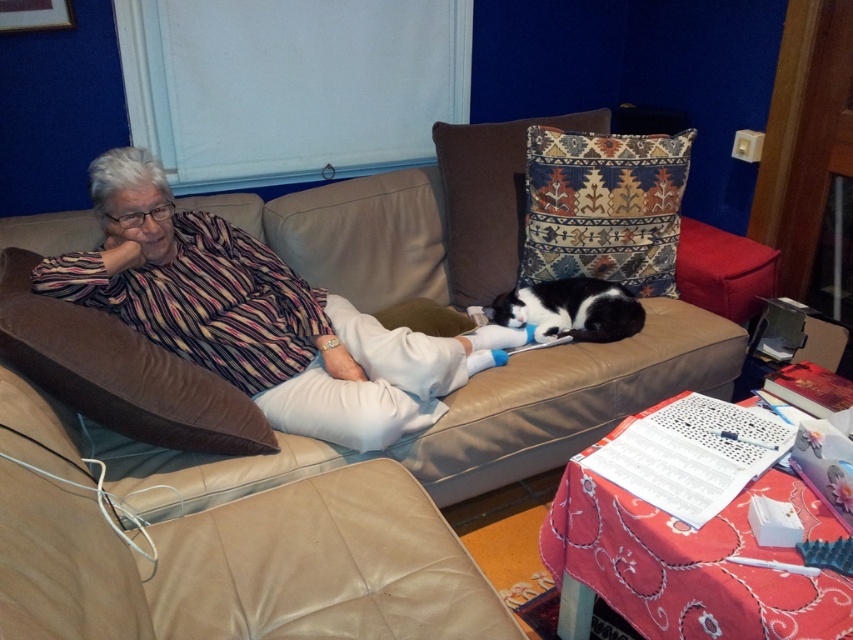
Consider the image. You are a photographer taking a closeup shot of the striped fabric shirt at center and the black fur cat at center. Which object should you focus on first to ensure both are in focus?

You should focus on the striped fabric shirt at center first because it is closer to the viewer than the black fur cat at center, so adjusting focus from near to far will help both be in focus.

You are a photographer trying to capture the striped fabric shirt at center and the black fur cat at center in the same frame. Based on their positions, which one is higher in the image?

The striped fabric shirt at center is located above the black fur cat at center, so the striped fabric shirt at center is higher in the image.